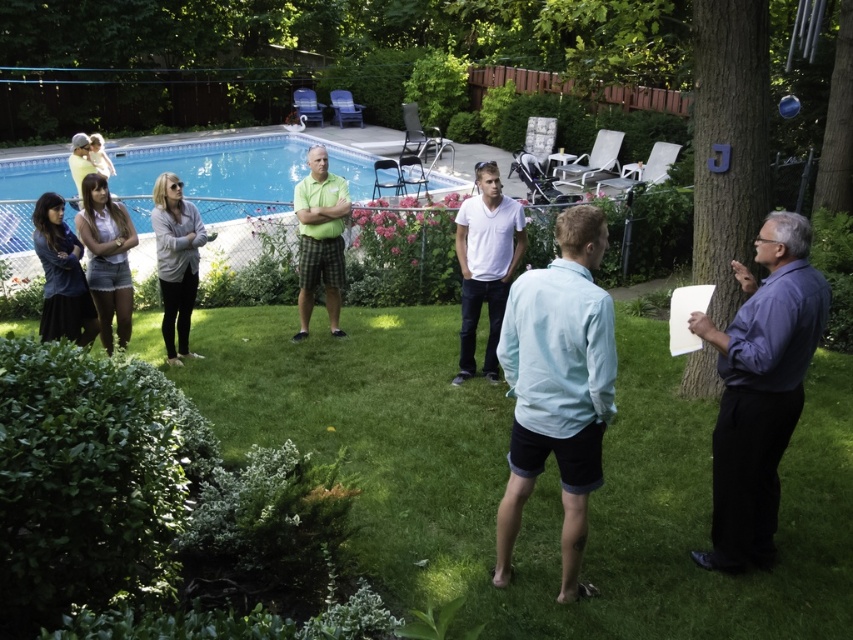
Which is above, blue tile swimming pool at upper left or denim jacket at lower left?

blue tile swimming pool at upper left

Which of these two, blue tile swimming pool at upper left or denim jacket at lower left, stands shorter?

Standing shorter between the two is denim jacket at lower left.

Who is more forward, (244,168) or (33,244)?

Point (33,244) is more forward.

At what (x,y) coordinates should I click in order to perform the action: click on blue tile swimming pool at upper left. Please return your answer as a coordinate pair (x, y). Looking at the image, I should click on (215, 173).

Does blue tile swimming pool at upper left appear on the left side of denim shorts at left?

Correct, you'll find blue tile swimming pool at upper left to the left of denim shorts at left.

Which is in front, point (263, 179) or point (83, 205)?

Point (83, 205) is in front.

You are a GUI agent. You are given a task and a screenshot of the screen. Output one action in this format:
    pyautogui.click(x=<x>, y=<y>)
    Task: Click on the blue tile swimming pool at upper left
    The width and height of the screenshot is (853, 640).
    Given the screenshot: What is the action you would take?
    pyautogui.click(x=215, y=173)

You are a GUI agent. You are given a task and a screenshot of the screen. Output one action in this format:
    pyautogui.click(x=<x>, y=<y>)
    Task: Click on the blue tile swimming pool at upper left
    The image size is (853, 640).
    Given the screenshot: What is the action you would take?
    pyautogui.click(x=215, y=173)

Looking at this image, does light blue cotton shirt at center appear under blue tile swimming pool at upper left?

Correct, light blue cotton shirt at center is located below blue tile swimming pool at upper left.

Describe the element at coordinates (558, 387) in the screenshot. I see `light blue cotton shirt at center` at that location.

Is point (566, 356) in front of point (242, 198)?

Yes.

The width and height of the screenshot is (853, 640). What are the coordinates of `light blue cotton shirt at center` in the screenshot? It's located at (558, 387).